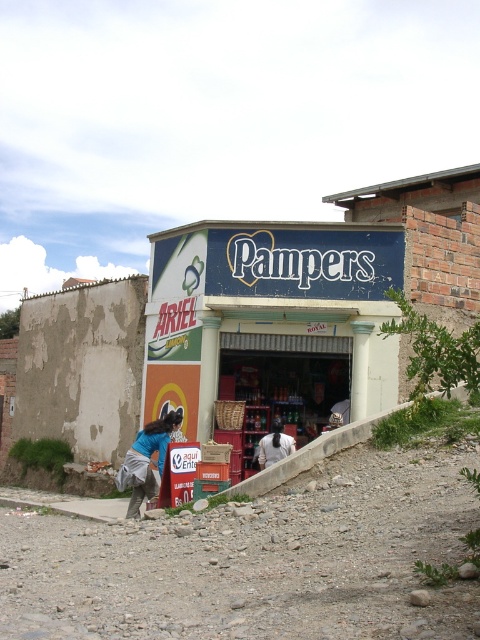
Question: Is blue matte signboard at center to the right of blue fabric shirt at lower center from the viewer's perspective?

Choices:
 (A) yes
 (B) no

Answer: (A)

Question: Considering the real-world distances, which object is closest to the blue matte signboard at center?

Choices:
 (A) blue fabric shirt at lower center
 (B) white fabric at center

Answer: (B)

Question: Which of these objects is positioned closest to the blue fabric shirt at lower center?

Choices:
 (A) white fabric at center
 (B) blue matte signboard at center

Answer: (A)

Question: Is blue matte signboard at center to the right of white fabric at center from the viewer's perspective?

Choices:
 (A) no
 (B) yes

Answer: (B)

Question: Does blue fabric shirt at lower center come in front of white fabric at center?

Choices:
 (A) yes
 (B) no

Answer: (A)

Question: Estimate the real-world distances between objects in this image. Which object is farther from the blue matte signboard at center?

Choices:
 (A) white fabric at center
 (B) blue fabric shirt at lower center

Answer: (B)